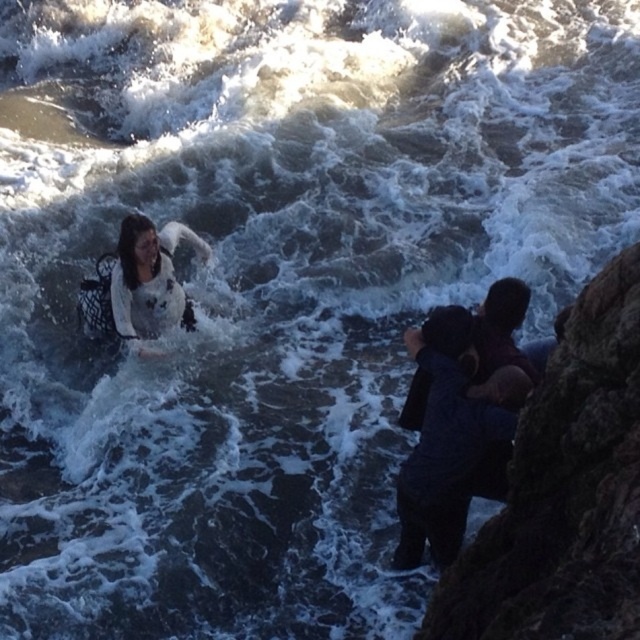
Question: Which object is closer to the camera taking this photo?

Choices:
 (A) white matte dress at lower left
 (B) green mossy rock at right

Answer: (B)

Question: Is dark blue fabric at right to the left of white matte dress at lower left from the viewer's perspective?

Choices:
 (A) yes
 (B) no

Answer: (B)

Question: Which of the following is the closest to the observer?

Choices:
 (A) (106, 269)
 (B) (408, 339)
 (C) (589, 301)

Answer: (C)

Question: Is dark blue fabric at right to the right of white matte dress at lower left from the viewer's perspective?

Choices:
 (A) no
 (B) yes

Answer: (B)

Question: Can you confirm if green mossy rock at right is positioned to the left of white matte dress at lower left?

Choices:
 (A) yes
 (B) no

Answer: (B)

Question: Which point appears closest to the camera in this image?

Choices:
 (A) (472, 394)
 (B) (109, 296)

Answer: (A)